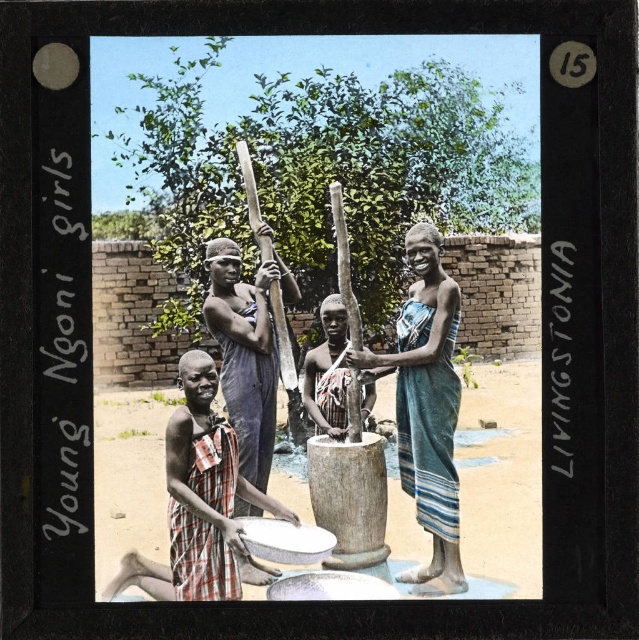
You are a photographer trying to capture the scene from the front. You want to focus on the blue striped cloth at center without the brown dirt field at lower center blocking it. Is this possible?

The blue striped cloth at center is behind the brown dirt field at lower center, so it will be blocked by the brown dirt field at lower center. You cannot focus on the blue striped cloth at center without the brown dirt field at lower center blocking it.

You are standing at the point labeled point (212, 291) and want to move towards the point labeled point (511, 456). According to the scene description, will you be moving forward or backward?

Since point (511, 456) is in front of point (212, 291), moving towards it would mean moving forward.